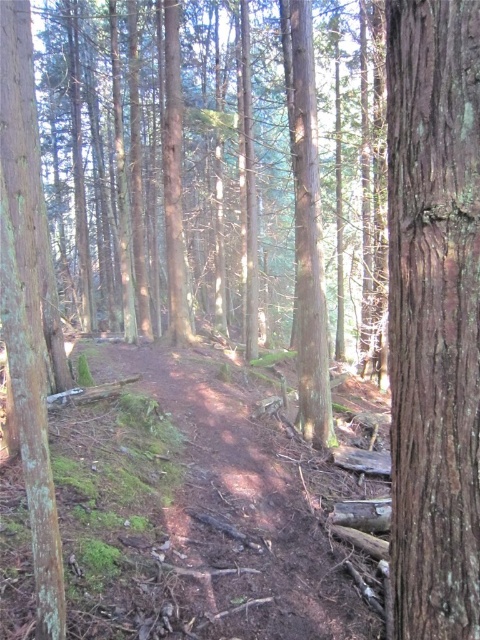
Question: Does smooth brown tree trunk at center-right have a smaller size compared to brown dirt track at center?

Choices:
 (A) yes
 (B) no

Answer: (B)

Question: Among these objects, which one is nearest to the camera?

Choices:
 (A) smooth brown tree trunk at left
 (B) smooth brown tree trunk at center-right

Answer: (B)

Question: From the image, what is the correct spatial relationship of brown dirt track at center in relation to smooth brown tree trunk at left?

Choices:
 (A) below
 (B) above

Answer: (A)

Question: Does smooth brown tree trunk at center-right appear over brown dirt track at center?

Choices:
 (A) no
 (B) yes

Answer: (B)

Question: Which point is farther to the camera?

Choices:
 (A) (434, 324)
 (B) (2, 230)
 (C) (184, 500)

Answer: (C)

Question: Which object is the closest to the brown dirt track at center?

Choices:
 (A) smooth brown tree trunk at left
 (B) smooth brown tree trunk at center-right

Answer: (B)